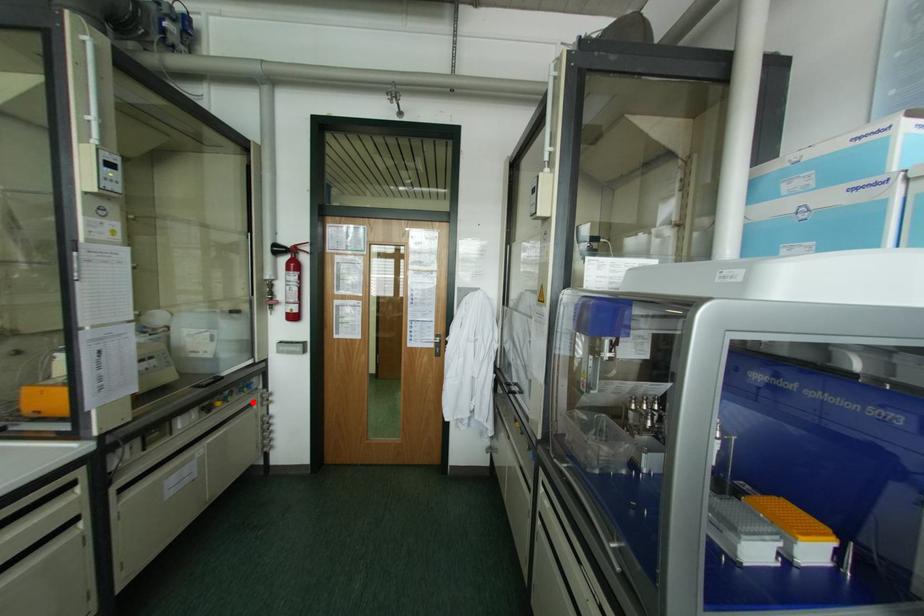
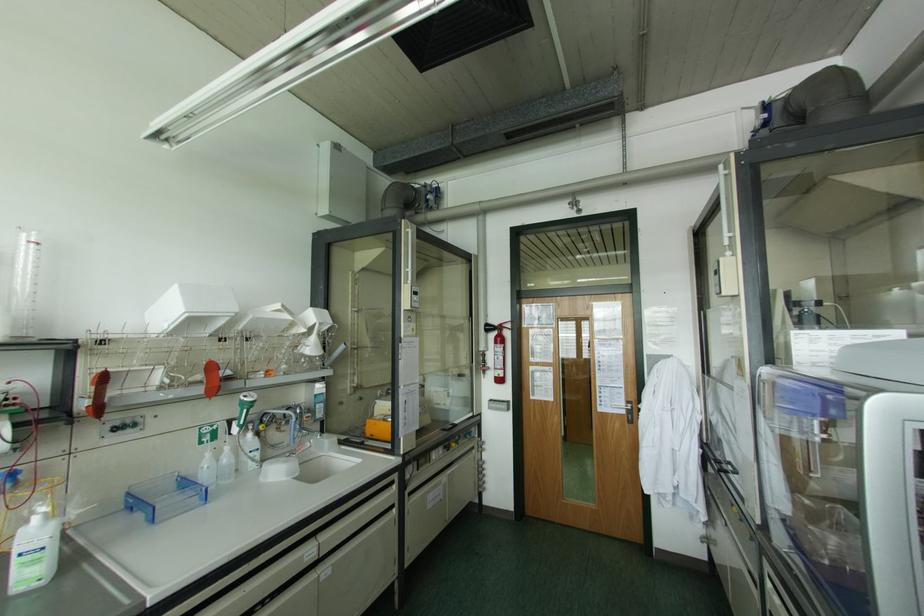
Question: I am providing you with two images of the same scene from different viewpoints. Given a red point in image1, look at the same physical point in image2. Is it:

Choices:
 (A) Closer to the viewpoint
 (B) Farther from the viewpoint

Answer: (B)